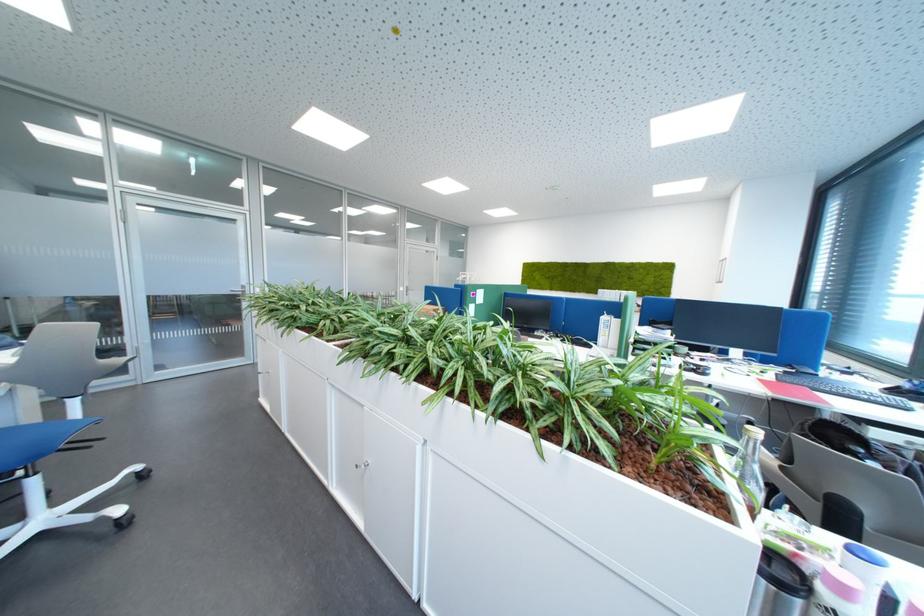
Image resolution: width=924 pixels, height=616 pixels. Find the location of `red notebook`. red notebook is located at coordinates point(793,392).